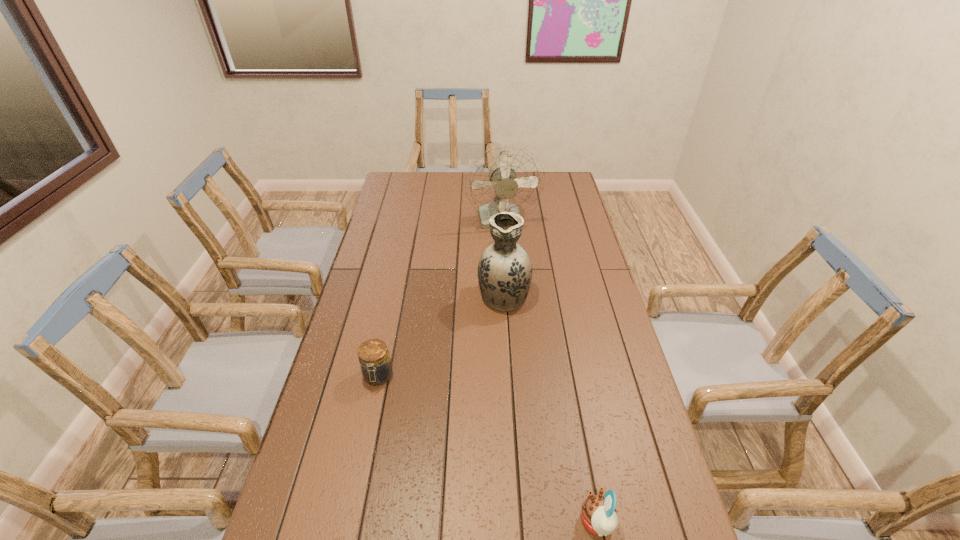
The image size is (960, 540). I want to click on the tallest object, so click(x=505, y=179).

Locate an element on the screen. fan is located at coordinates (505, 179).

Identify the location of the third shortest object. The width and height of the screenshot is (960, 540). (505, 270).

Image resolution: width=960 pixels, height=540 pixels. Identify the location of vase. (505, 270).

Where is `jar`? This screenshot has height=540, width=960. jar is located at coordinates (376, 367).

Identify the location of the leftmost object. (376, 367).

You are a GUI agent. You are given a task and a screenshot of the screen. Output one action in this format:
    pyautogui.click(x=<x>, y=<y>)
    Task: Click on the vacant space located in front of the fan to blow air
    This screenshot has height=540, width=960.
    Given the screenshot: What is the action you would take?
    pyautogui.click(x=504, y=250)

Find the location of a particular element. vacant space located with the handle on the side of the second farthest object is located at coordinates (500, 231).

Locate an element on the screen. This screenshot has height=540, width=960. vacant space situated with the handle on the side of the second farthest object is located at coordinates (501, 256).

Identify the location of free region located 0.160m with the handle on the side of the second farthest object. (501, 249).